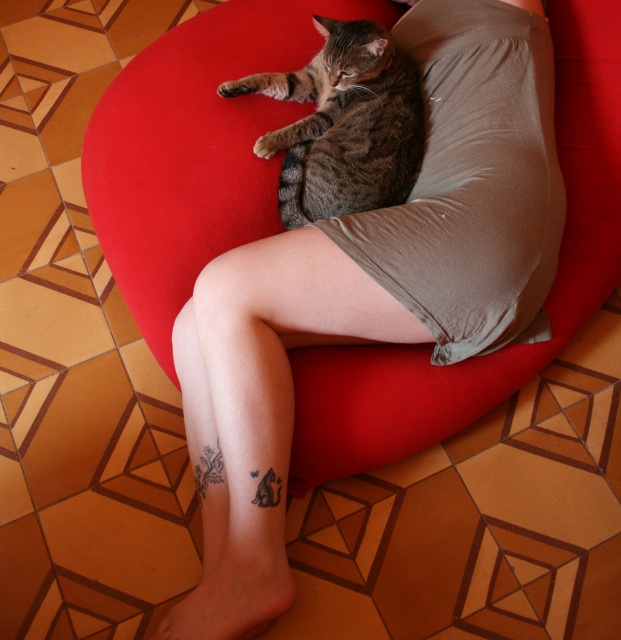
Question: In this image, where is velvet red bean bag chair at center located relative to tabby fur cat at center?

Choices:
 (A) left
 (B) right

Answer: (B)

Question: Can you confirm if velvet red bean bag chair at center is positioned to the left of tabby fur cat at center?

Choices:
 (A) no
 (B) yes

Answer: (A)

Question: Is velvet red bean bag chair at center wider than tabby fur cat at center?

Choices:
 (A) yes
 (B) no

Answer: (A)

Question: Which object appears closest to the camera in this image?

Choices:
 (A) tabby fur cat at center
 (B) velvet red bean bag chair at center

Answer: (A)